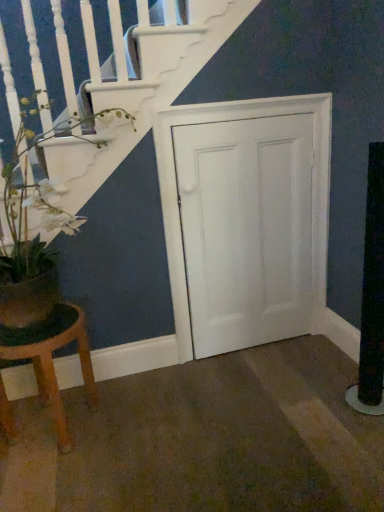
At what (x,y) coordinates should I click in order to perform the action: click on unoccupied area in front of wooden stool at lower left. Please return your answer as a coordinate pair (x, y). Looking at the image, I should click on click(x=57, y=479).